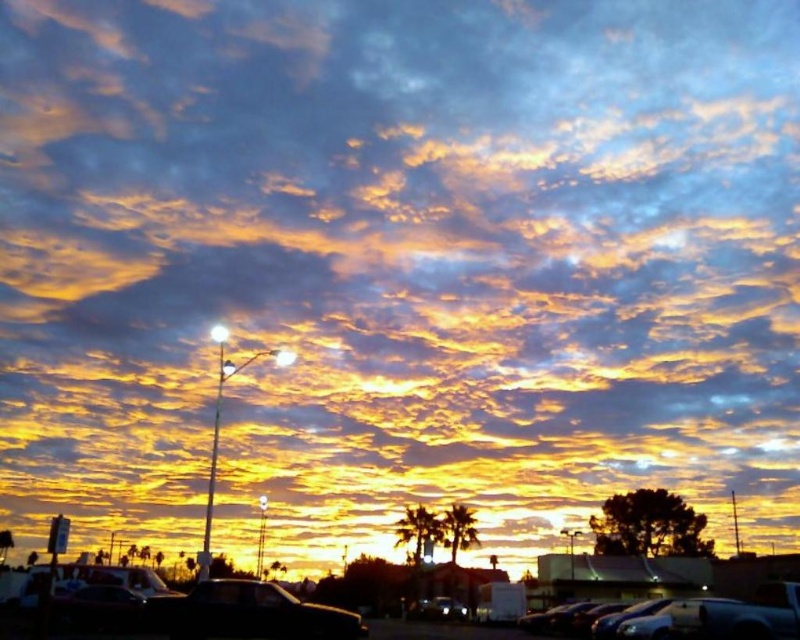
Question: Can you confirm if black glossy car at lower center is positioned to the right of black asphalt parking lot at lower center?

Choices:
 (A) no
 (B) yes

Answer: (A)

Question: Is black glossy car at lower center above black asphalt parking lot at lower center?

Choices:
 (A) yes
 (B) no

Answer: (B)

Question: Is black glossy car at lower center bigger than black asphalt parking lot at lower center?

Choices:
 (A) yes
 (B) no

Answer: (B)